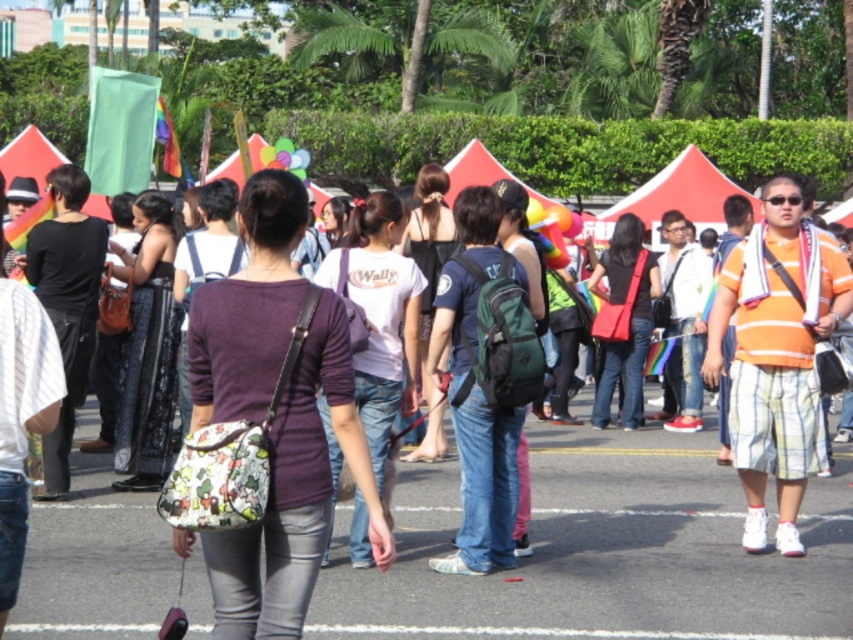
Does point (149, 408) come in front of point (604, 275)?

Yes, point (149, 408) is closer to viewer.

Who is higher up, black satin dress at center or matte red bag at center?

black satin dress at center

Where is `black satin dress at center`? This screenshot has width=853, height=640. black satin dress at center is located at coordinates (148, 349).

Image resolution: width=853 pixels, height=640 pixels. Find the location of `black satin dress at center`. black satin dress at center is located at coordinates (148, 349).

Between point (242, 548) and point (657, 280), which one is positioned in front?

Positioned in front is point (242, 548).

Is matte purple shirt at center shorter than matte red bag at center?

Correct, matte purple shirt at center is not as tall as matte red bag at center.

The width and height of the screenshot is (853, 640). What do you see at coordinates (276, 416) in the screenshot? I see `matte purple shirt at center` at bounding box center [276, 416].

Where is `matte purple shirt at center`? This screenshot has height=640, width=853. matte purple shirt at center is located at coordinates (276, 416).

Between white matte shirt at center and matte red bag at center, which one appears on the left side from the viewer's perspective?

Positioned to the left is white matte shirt at center.

Is point (416, 332) positioned after point (654, 294)?

No, it is not.

At what (x,y) coordinates should I click in order to perform the action: click on white matte shirt at center. Please return your answer as a coordinate pair (x, y). This screenshot has height=640, width=853. Looking at the image, I should click on (379, 317).